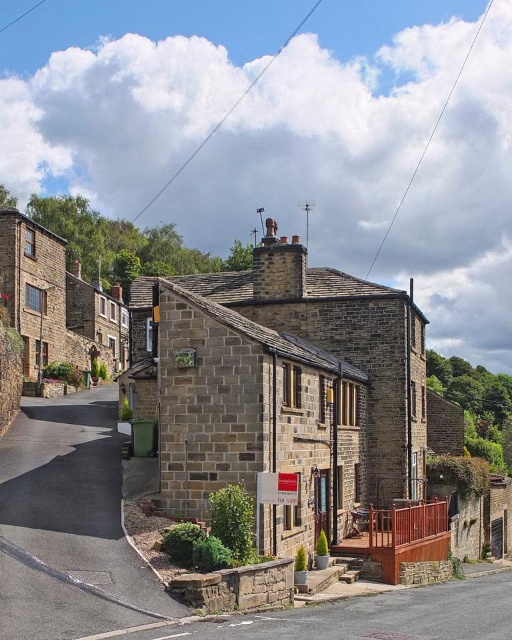
Question: Does brown stone house at center appear over asphalt road at lower left?

Choices:
 (A) no
 (B) yes

Answer: (B)

Question: Which of the following is the closest to the observer?

Choices:
 (A) (73, 456)
 (B) (304, 353)

Answer: (A)

Question: Which point is farther to the camera?

Choices:
 (A) (56, 352)
 (B) (42, 545)

Answer: (A)

Question: Is brown stone house at center closer to camera compared to asphalt road at lower left?

Choices:
 (A) no
 (B) yes

Answer: (A)

Question: Considering the relative positions of brown stone house at center and asphalt road at lower left in the image provided, where is brown stone house at center located with respect to asphalt road at lower left?

Choices:
 (A) below
 (B) above

Answer: (B)